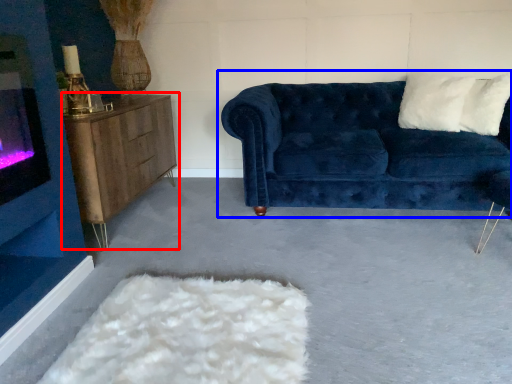
Question: Which object appears closest to the camera in this image, table (highlighted by a red box) or studio couch (highlighted by a blue box)?

Choices:
 (A) table
 (B) studio couch

Answer: (A)